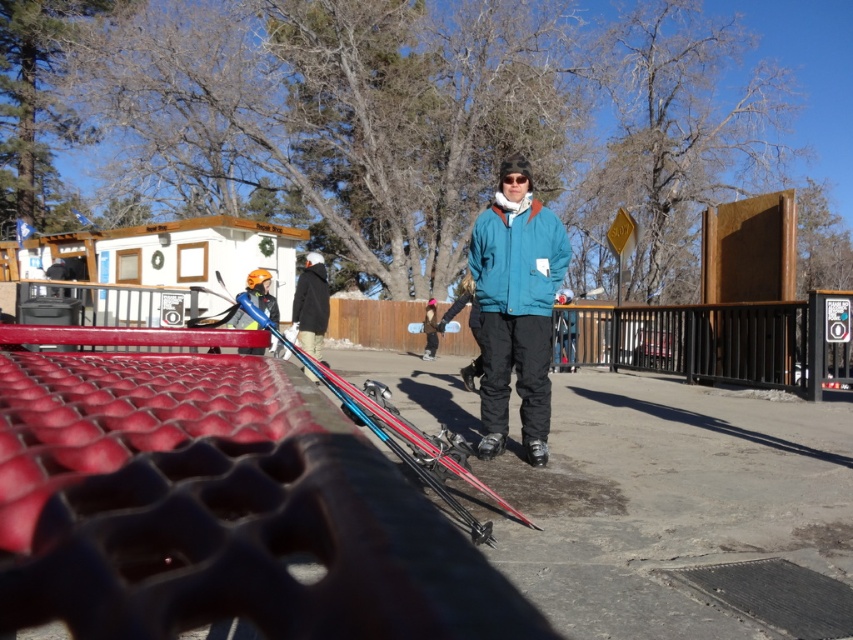
Which is more to the right, black matte jacket at center or dark blue jacket at center?

From the viewer's perspective, dark blue jacket at center appears more on the right side.

Is black matte jacket at center positioned at the back of dark blue jacket at center?

That is False.

Is point (305, 291) in front of point (433, 305)?

Yes, it is in front of point (433, 305).

At what (x,y) coordinates should I click in order to perform the action: click on black matte jacket at center. Please return your answer as a coordinate pair (x, y). The image size is (853, 640). Looking at the image, I should click on (311, 300).

Is shiny blue ski at center taller than dark blue jacket at center?

No, shiny blue ski at center is not taller than dark blue jacket at center.

Is shiny blue ski at center bigger than dark blue jacket at center?

No, shiny blue ski at center is not bigger than dark blue jacket at center.

Between point (231, 298) and point (428, 308), which one is positioned in front?

Positioned in front is point (231, 298).

Locate an element on the screen. The image size is (853, 640). shiny blue ski at center is located at coordinates (369, 403).

This screenshot has height=640, width=853. I want to click on shiny blue ski at center, so click(369, 403).

Which is in front, point (405, 428) or point (312, 308)?

Point (405, 428) is in front.

You are a GUI agent. You are given a task and a screenshot of the screen. Output one action in this format:
    pyautogui.click(x=<x>, y=<y>)
    Task: Click on the shiny blue ski at center
    This screenshot has width=853, height=640.
    Given the screenshot: What is the action you would take?
    pyautogui.click(x=369, y=403)